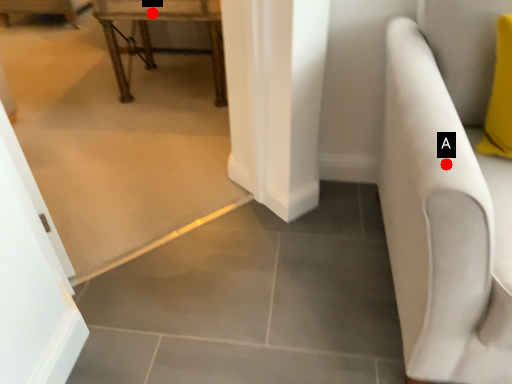
Question: Two points are circled on the image, labeled by A and B beside each circle. Which of the following is the closest to the observer?

Choices:
 (A) A is closer
 (B) B is closer

Answer: (A)